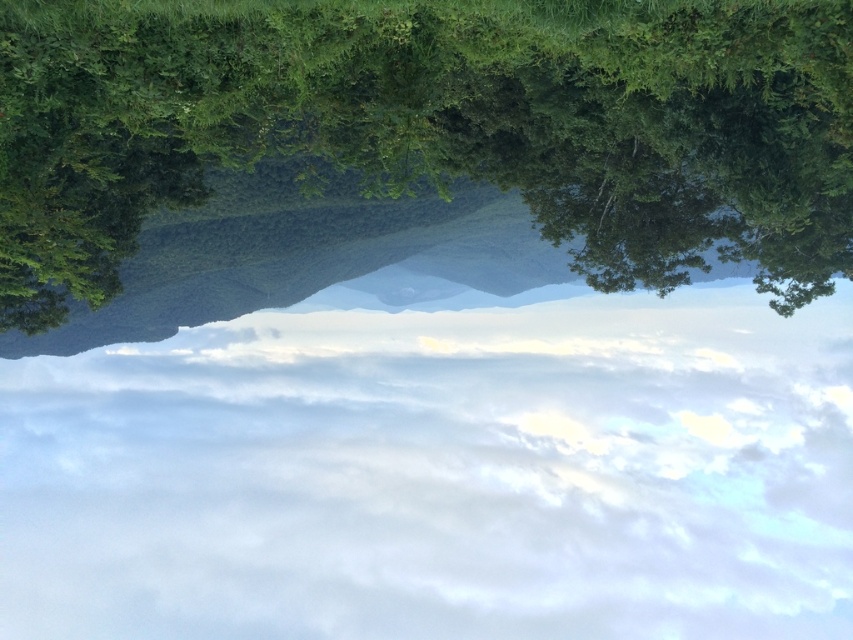
Identify the location of white fluffy cloud at center. (439, 474).

I want to click on white fluffy cloud at center, so click(x=439, y=474).

Identify the location of white fluffy cloud at center. (439, 474).